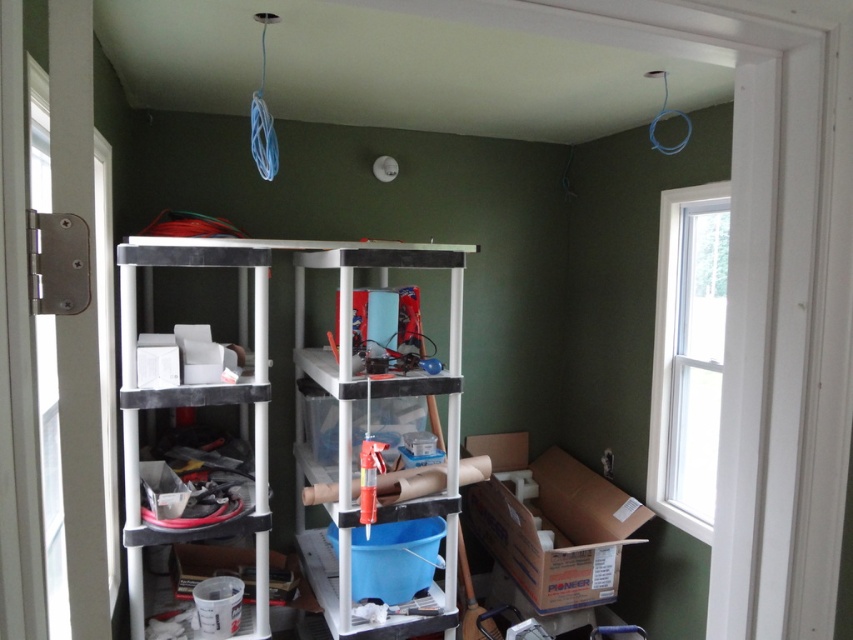
Between point (297, 365) and point (250, 388), which one is positioned in front?

Point (250, 388) is more forward.

Can you confirm if white plastic shelf at center is taller than matte black shelving unit at left?

Yes.

Describe the element at coordinates (387, 378) in the screenshot. I see `white plastic shelf at center` at that location.

This screenshot has height=640, width=853. Find the location of `white plastic shelf at center`. white plastic shelf at center is located at coordinates (387, 378).

Is cardboard box at lower right to the left of white plastic shelf at center from the viewer's perspective?

Incorrect, cardboard box at lower right is not on the left side of white plastic shelf at center.

Can you confirm if cardboard box at lower right is positioned below white plastic shelf at center?

Indeed, cardboard box at lower right is positioned under white plastic shelf at center.

Is point (538, 509) less distant than point (370, 246)?

No, (538, 509) is behind (370, 246).

What are the coordinates of `cardboard box at lower right` in the screenshot? It's located at (550, 522).

Can you confirm if cardboard box at lower right is thinner than matte black shelving unit at left?

No, cardboard box at lower right is not thinner than matte black shelving unit at left.

Which is behind, point (534, 525) or point (238, 250)?

The point (534, 525) is more distant.

Which is in front, point (573, 516) or point (219, 387)?

Point (219, 387) is in front.

Find the location of a particular element. This screenshot has height=640, width=853. cardboard box at lower right is located at coordinates click(x=550, y=522).